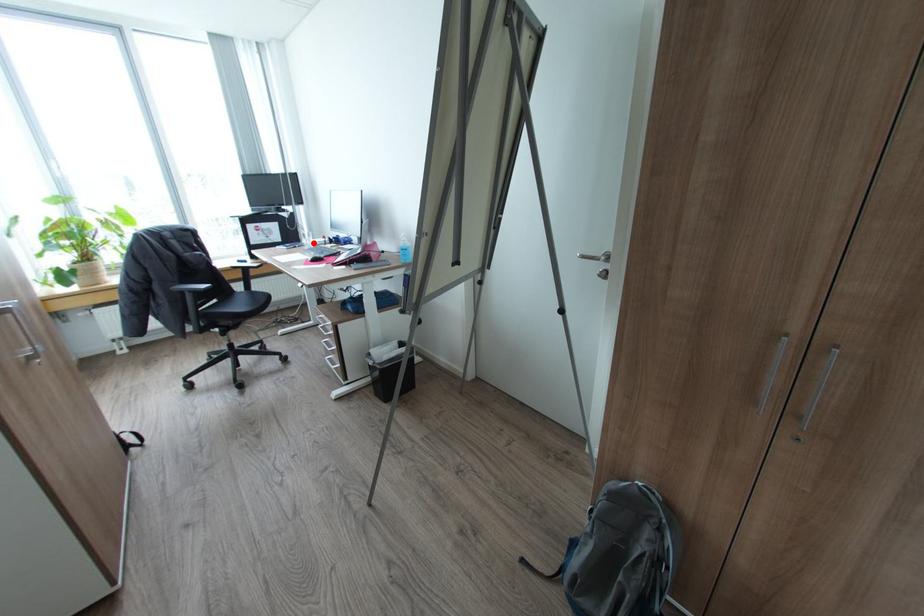
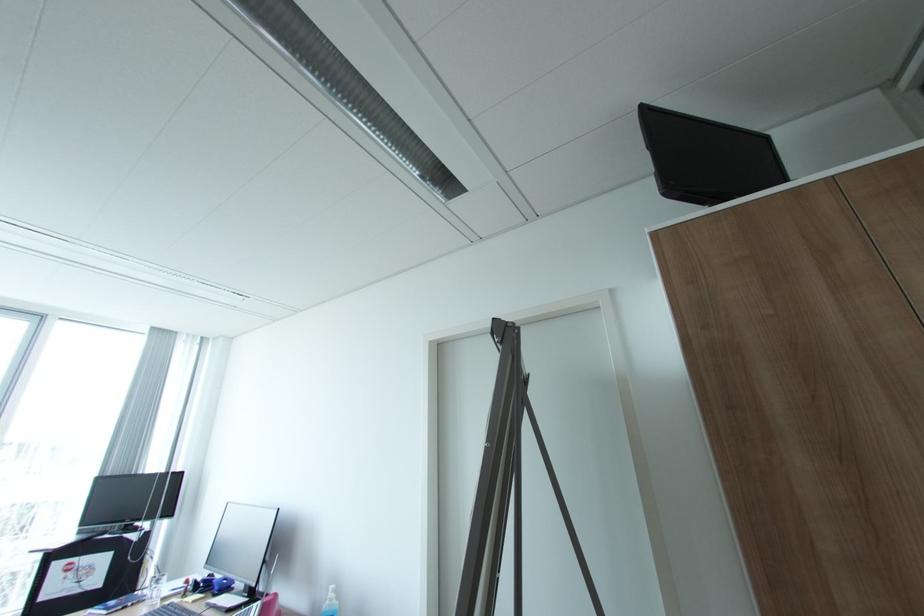
In the second image, find the point that corresponds to the highlighted location in the first image.

(160, 596)